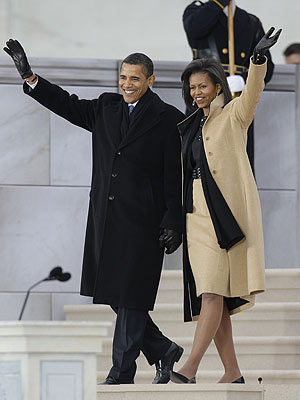
The width and height of the screenshot is (300, 400). What are the coordinates of `stairs` in the screenshot? It's located at (269, 372), (274, 348), (277, 318), (282, 286).